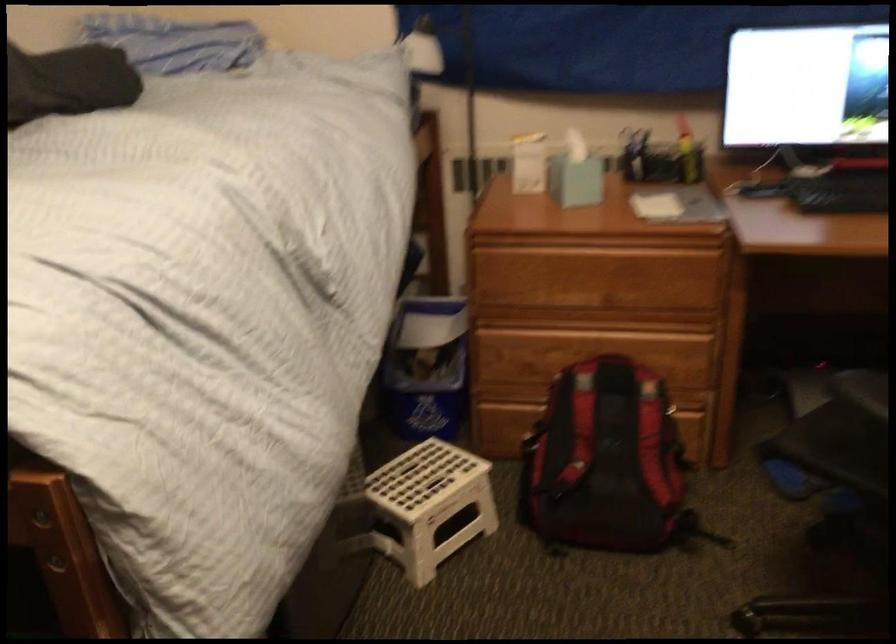
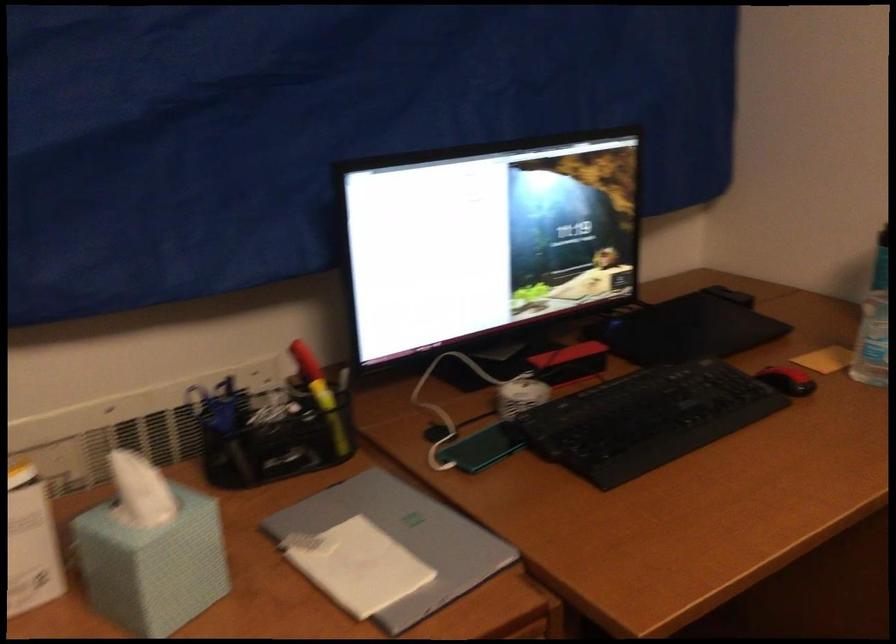
Find the pixel in the second image that matches point (685, 145) in the first image.

(321, 395)